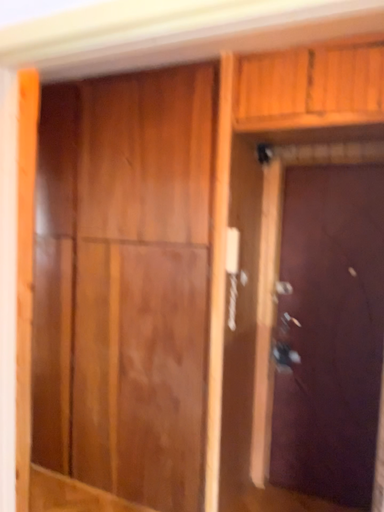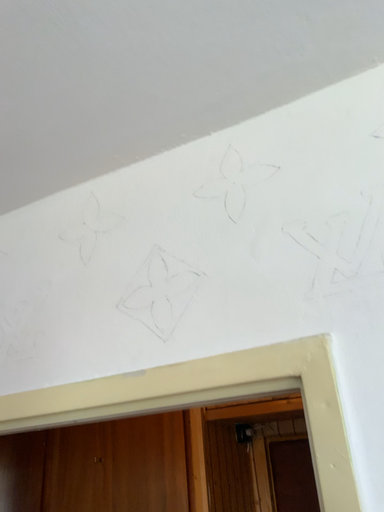
Question: How did the camera likely rotate when shooting the video?

Choices:
 (A) rotated downward
 (B) rotated upward

Answer: (B)